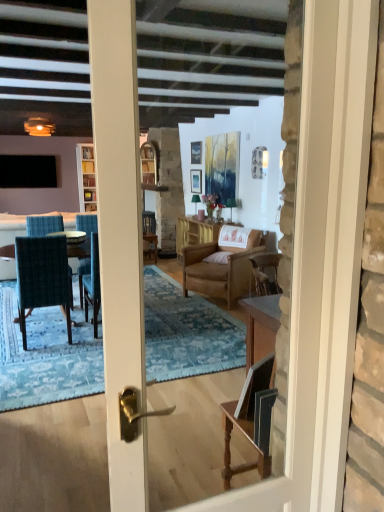
Question: Is matte wooden picture frame at center, which is counted as the 2th picture frame, starting from the top, taller or shorter than metallic silver picture frame at upper center, the 2th picture frame when ordered from bottom to top?

Choices:
 (A) tall
 (B) short

Answer: (A)

Question: Is matte wooden picture frame at center, the first picture frame from the bottom, bigger or smaller than metallic silver picture frame at upper center, the 2th picture frame when ordered from bottom to top?

Choices:
 (A) small
 (B) big

Answer: (B)

Question: Based on their relative distances, which object is nearer to the black matte television at left?

Choices:
 (A) teal fabric chair at left, placed as the first chair when sorted from left to right
 (B) metallic silver picture frame at upper center, the 2th picture frame when ordered from bottom to top
 (C) brown woven table at center
 (D) matte wooden picture frame at center, the first picture frame from the bottom
 (E) brown leather armchair at center, marked as the second chair in a left-to-right arrangement

Answer: (D)

Question: Which object is the closest to the matte wooden picture frame at center, which is counted as the 2th picture frame, starting from the top?

Choices:
 (A) teal fabric chair at left, placed as the first chair when sorted from front to back
 (B) black matte television at left
 (C) clear glass cabinet at center
 (D) metallic silver picture frame at upper center, the 1th picture frame in the top-to-bottom sequence
 (E) brown leather armchair at center, acting as the second chair starting from the front

Answer: (D)